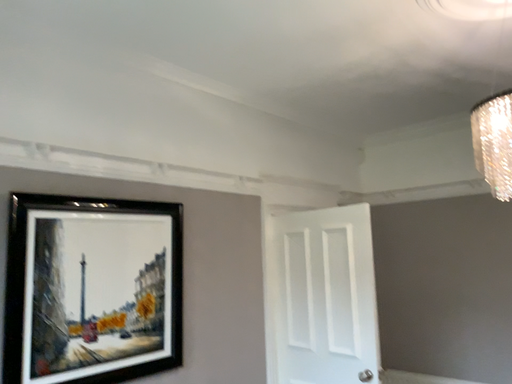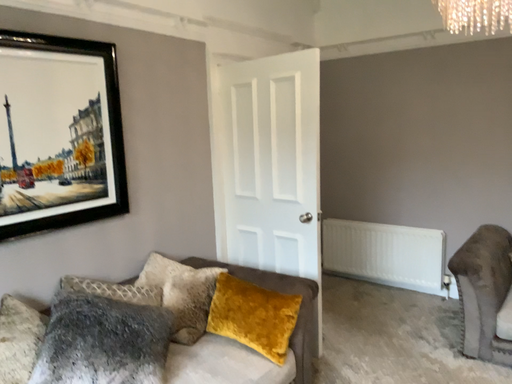
Question: How did the camera likely rotate when shooting the video?

Choices:
 (A) rotated left
 (B) rotated right

Answer: (B)